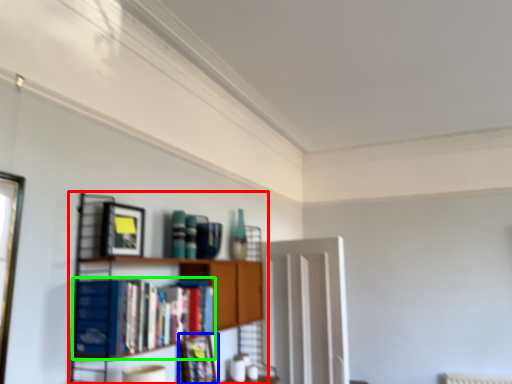
Question: Which is nearer to the shelf (highlighted by a red box)? picture frame (highlighted by a blue box) or book (highlighted by a green box).

Choices:
 (A) picture frame
 (B) book

Answer: (B)